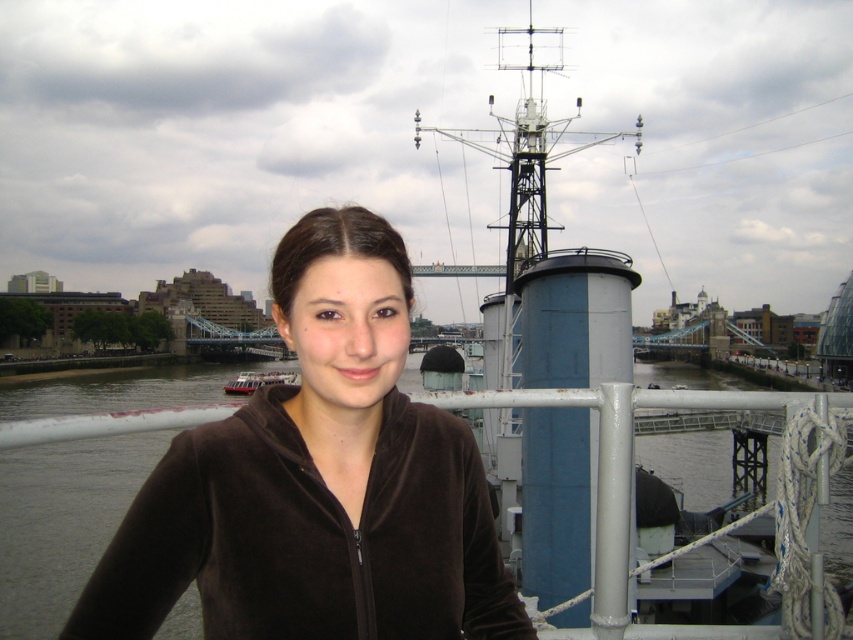
Please look at the point at coordinate (62, 522). What color is the object located there?

The point at coordinate (62, 522) indicates brown water at center.

You are a photographer on a boat and want to capture the metallic silver boat at center and the brown water at center in your shot. Which object is positioned to the right side of the other?

The brown water at center is to the right of the metallic silver boat at center.